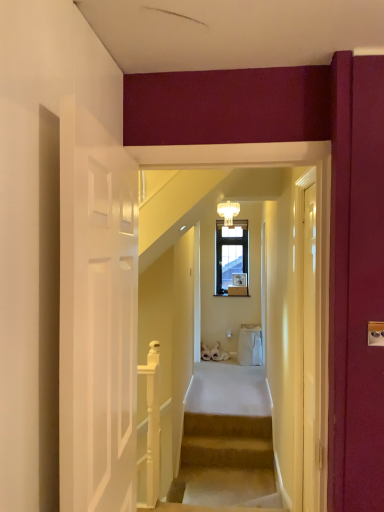
Question: Is translucent glass chandelier at upper center inside white glossy wooden handrail at lower left?

Choices:
 (A) no
 (B) yes

Answer: (A)

Question: Considering the relative positions of white glossy wooden handrail at lower left and translucent glass chandelier at upper center in the image provided, is white glossy wooden handrail at lower left behind translucent glass chandelier at upper center?

Choices:
 (A) no
 (B) yes

Answer: (A)

Question: From a real-world perspective, is white glossy wooden handrail at lower left below translucent glass chandelier at upper center?

Choices:
 (A) yes
 (B) no

Answer: (A)

Question: Would you say white glossy wooden handrail at lower left is outside translucent glass chandelier at upper center?

Choices:
 (A) yes
 (B) no

Answer: (A)

Question: Is white glossy wooden handrail at lower left facing away from translucent glass chandelier at upper center?

Choices:
 (A) yes
 (B) no

Answer: (B)

Question: Is white glossy wooden handrail at lower left facing towards translucent glass chandelier at upper center?

Choices:
 (A) no
 (B) yes

Answer: (A)

Question: Considering the relative sizes of translucent glass chandelier at upper center and clear glass door at right in the image provided, is translucent glass chandelier at upper center thinner than clear glass door at right?

Choices:
 (A) no
 (B) yes

Answer: (A)

Question: Is translucent glass chandelier at upper center behind clear glass door at right?

Choices:
 (A) no
 (B) yes

Answer: (B)

Question: Considering the relative sizes of translucent glass chandelier at upper center and clear glass door at right in the image provided, is translucent glass chandelier at upper center smaller than clear glass door at right?

Choices:
 (A) yes
 (B) no

Answer: (A)

Question: Could you tell me if translucent glass chandelier at upper center is turned towards clear glass door at right?

Choices:
 (A) no
 (B) yes

Answer: (B)

Question: Does translucent glass chandelier at upper center have a lesser height compared to clear glass door at right?

Choices:
 (A) no
 (B) yes

Answer: (B)

Question: From the image's perspective, is translucent glass chandelier at upper center under clear glass door at right?

Choices:
 (A) no
 (B) yes

Answer: (A)

Question: Does clear glass door at right have a larger size compared to white glossy wooden handrail at lower left?

Choices:
 (A) no
 (B) yes

Answer: (A)